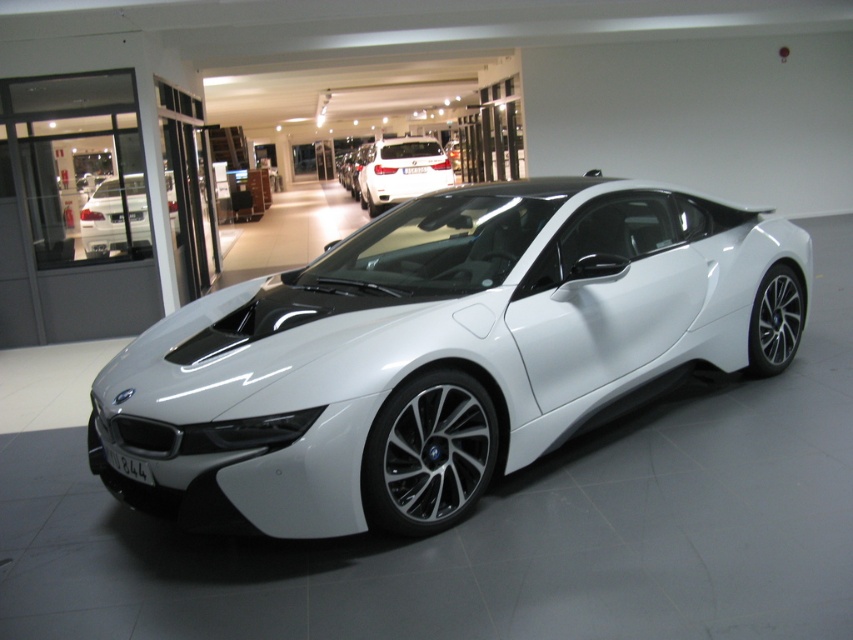
Is white glossy sedan at center further to camera compared to white matte car at center?

No, it is in front of white matte car at center.

Is white glossy sedan at center wider than white matte car at center?

Yes, white glossy sedan at center is wider than white matte car at center.

Who is more forward, (93,195) or (399,166)?

Point (93,195) is in front.

Where is `white glossy sedan at center`? The image size is (853, 640). white glossy sedan at center is located at coordinates (115, 216).

This screenshot has width=853, height=640. I want to click on white glossy sports car at center, so click(437, 353).

Which is more to the right, white glossy sports car at center or white matte car at center?

white glossy sports car at center is more to the right.

Where is `white glossy sports car at center`? white glossy sports car at center is located at coordinates (437, 353).

Is point (442, 362) positioned behind point (103, 227)?

No, (442, 362) is closer to viewer.

Does point (201, 387) lie in front of point (125, 230)?

Yes, point (201, 387) is closer to viewer.

Image resolution: width=853 pixels, height=640 pixels. I want to click on white glossy sports car at center, so click(437, 353).